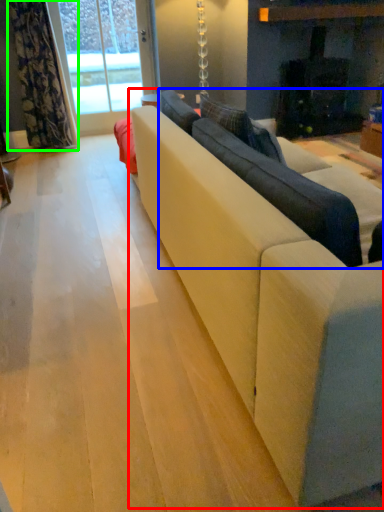
Question: Considering the real-world distances, which object is farthest from studio couch (highlighted by a red box)? couch (highlighted by a blue box) or curtain (highlighted by a green box)?

Choices:
 (A) couch
 (B) curtain

Answer: (B)